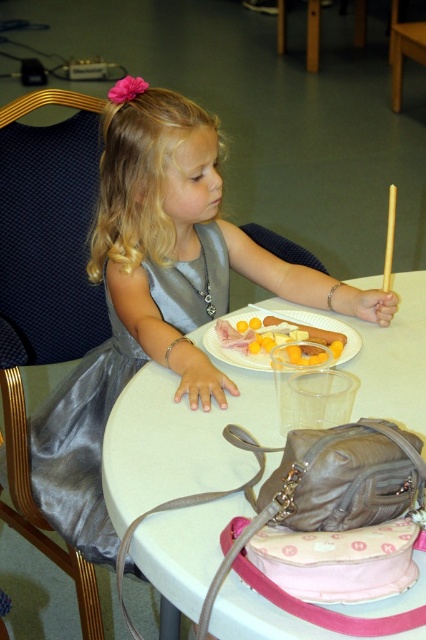
In the scene shown: You are a photographer standing in front of the girl wearing the silky silver dress at center. You want to take a closeup shot of her face without making her uncomfortable. Considering the distance between you and her dress, what is the minimum distance you should maintain to ensure you are not too close?

The minimum distance you should maintain is 3.32 feet, as that is the distance between you and the silky silver dress at center. To avoid being too close, you should stay at least that distance away.